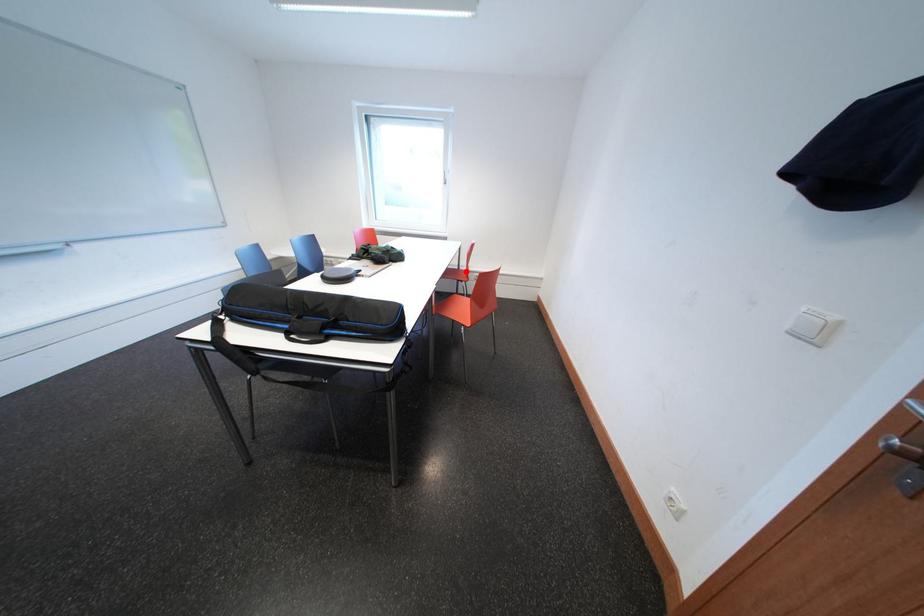
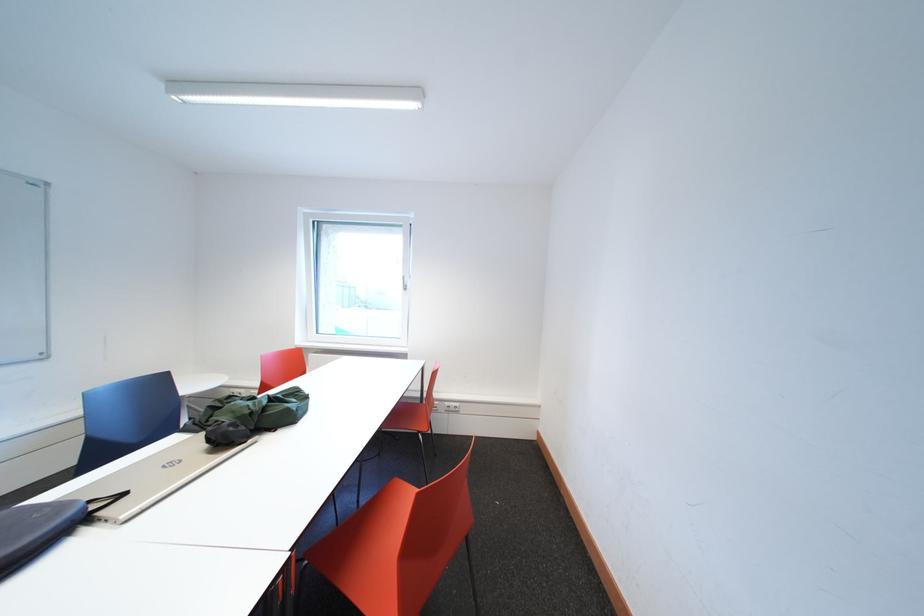
The point at the highlighted location is marked in the first image. Where is the corresponding point in the second image?

(429, 400)